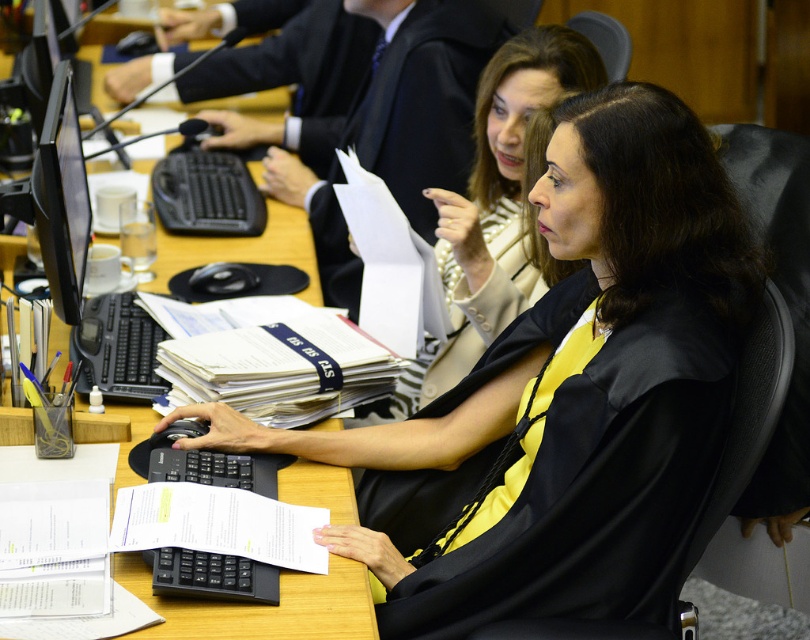
You are an observer in the courtroom. You need to determine the order of objects from closest to farthest from you. Which is closer to you, the wooden table at center or the white paper at lower center?

The wooden table at center is closer to you than the white paper at lower center because it is further to the viewer than the white paper at lower center.

Please provide the 2D coordinates of the wooden table at center in the image using the coordinate system where the bottom left corner is the origin. The coordinates are given as a tuple of two values between 0 and 1. For example, the center of the image would be at approximately 0.5, 0.5.

The wooden table at center is located at coordinates (263, 605).